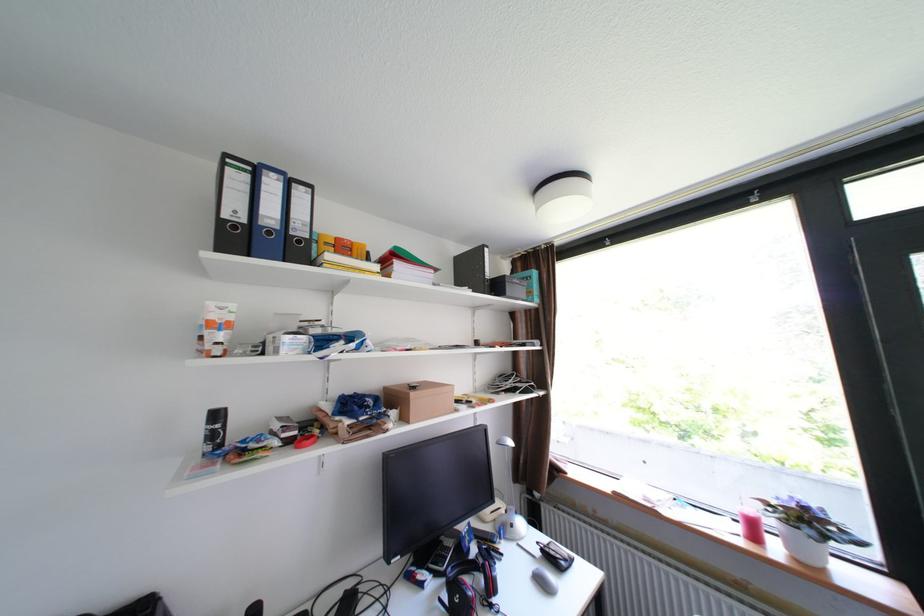
The image size is (924, 616). What do you see at coordinates (214, 430) in the screenshot?
I see `the black spray can` at bounding box center [214, 430].